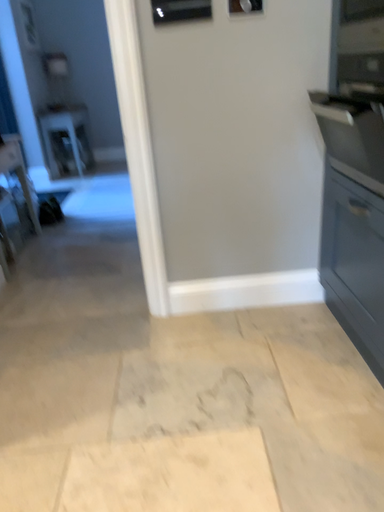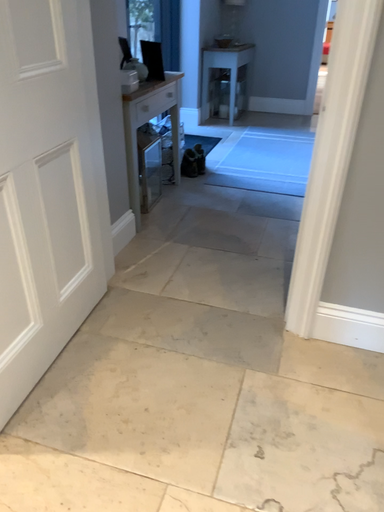
Question: How did the camera likely rotate when shooting the video?

Choices:
 (A) rotated left
 (B) rotated right

Answer: (A)